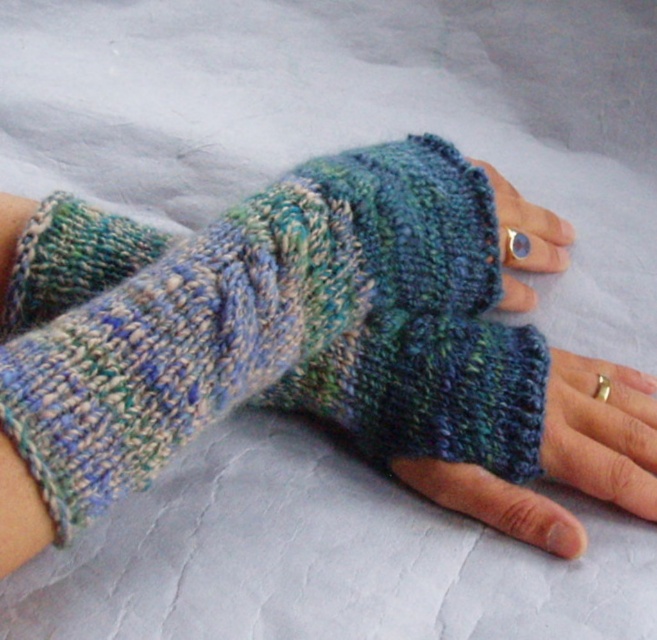
Question: Can you confirm if multicolored knitted fingerless gloves at center is bigger than knitted wool fingerless glove at center?

Choices:
 (A) no
 (B) yes

Answer: (B)

Question: Which point is closer to the camera?

Choices:
 (A) knitted wool fingerless glove at center
 (B) multicolored knitted fingerless gloves at center

Answer: (B)

Question: Is multicolored knitted fingerless gloves at center smaller than knitted wool fingerless glove at center?

Choices:
 (A) no
 (B) yes

Answer: (A)

Question: Does multicolored knitted fingerless gloves at center have a greater width compared to knitted wool fingerless glove at center?

Choices:
 (A) no
 (B) yes

Answer: (B)

Question: Which point is farther to the camera?

Choices:
 (A) multicolored knitted fingerless gloves at center
 (B) knitted wool fingerless glove at center

Answer: (B)